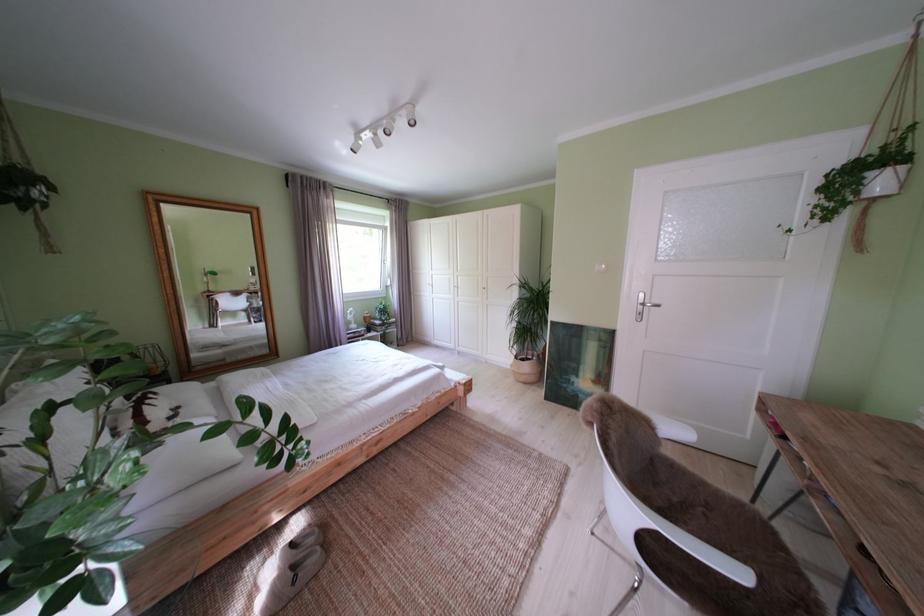
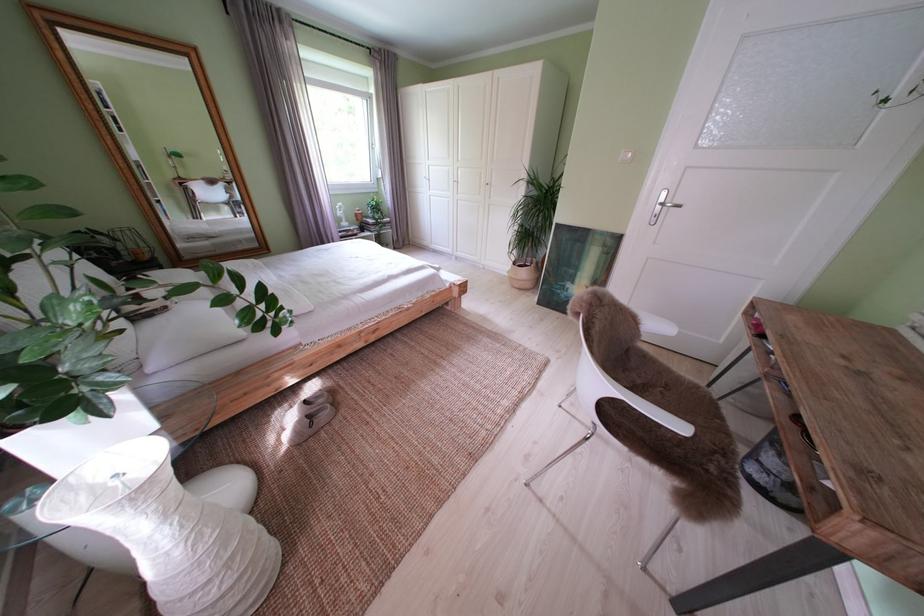
Which direction would the cameraman need to move to produce the second image?

The cameraman walked toward right, forward.